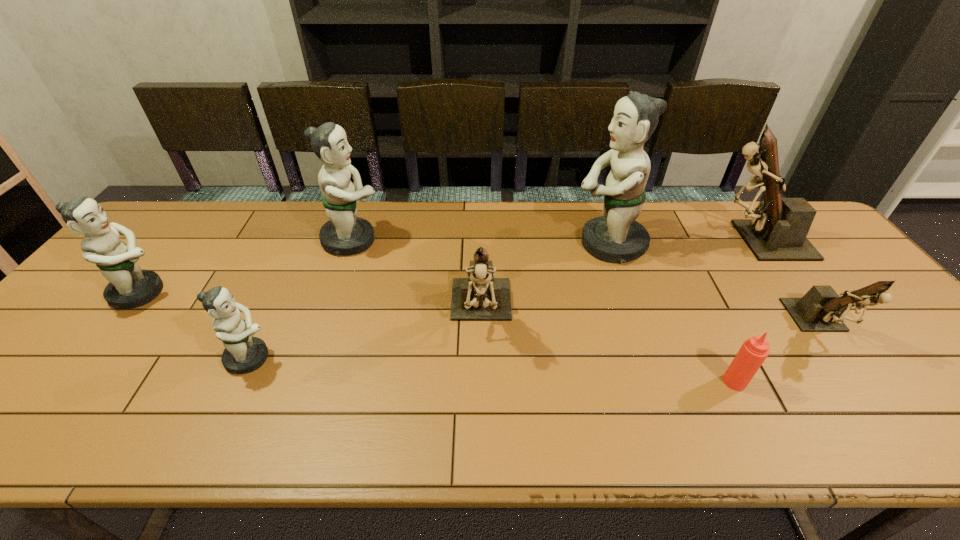
The image size is (960, 540). What are the coordinates of `free spot that satisfies the following two spatial constraints: 1. on the front-facing side of the third farthest green figurine; 2. on the back side of the sixth object from left to right` in the screenshot? It's located at (70, 382).

Find the location of a particular element. free space that satisfies the following two spatial constraints: 1. on the front-facing side of the smallest brown figurine; 2. on the front-facing side of the nearest green figurine is located at coordinates (844, 358).

Find the location of a particular element. Image resolution: width=960 pixels, height=540 pixels. free location that satisfies the following two spatial constraints: 1. on the front-facing side of the leftmost object; 2. on the back side of the Tabasco sauce is located at coordinates (70, 382).